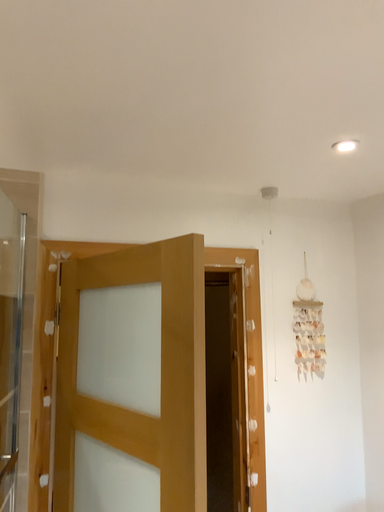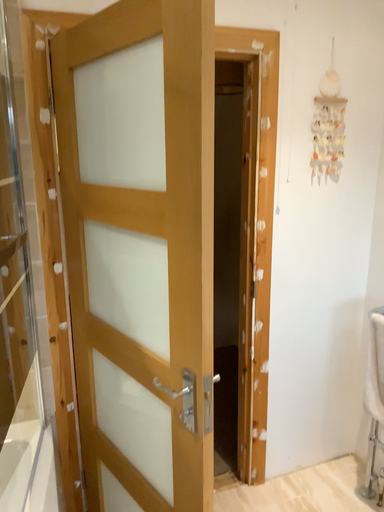
Question: Which way did the camera rotate in the video?

Choices:
 (A) rotated upward
 (B) rotated downward

Answer: (B)